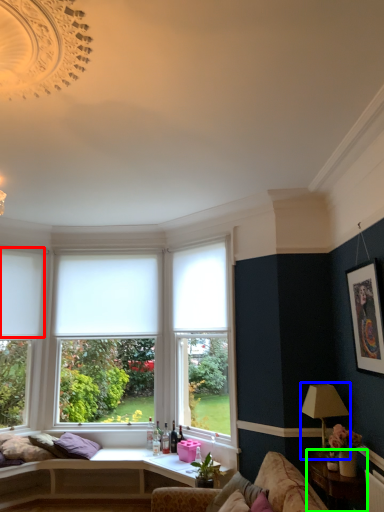
Question: Considering the real-world distances, which object is farthest from curtain (highlighted by a red box)? lamp (highlighted by a blue box) or table (highlighted by a green box)?

Choices:
 (A) lamp
 (B) table

Answer: (B)